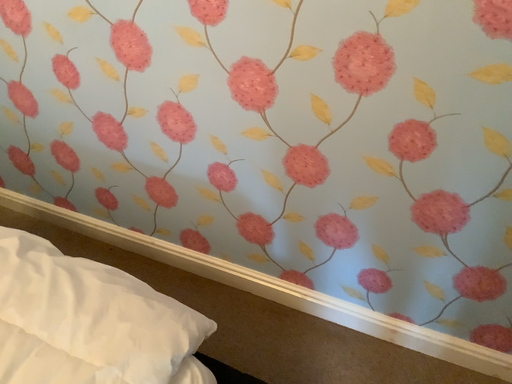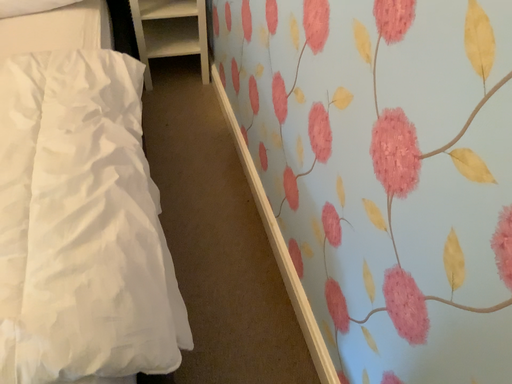
Question: Which way did the camera rotate in the video?

Choices:
 (A) rotated right
 (B) rotated left

Answer: (B)